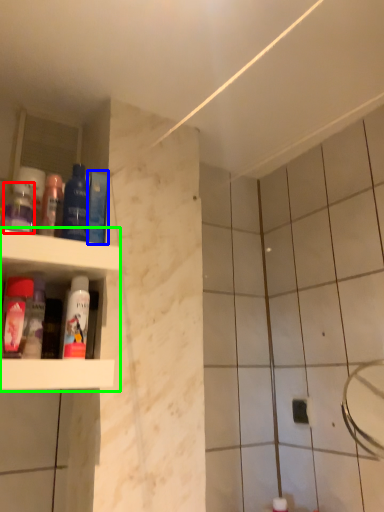
Question: Which object is the closest to the mouthwash (highlighted by a red box)? Choose among these: mouthwash (highlighted by a blue box) or shelf (highlighted by a green box).

Choices:
 (A) mouthwash
 (B) shelf

Answer: (B)